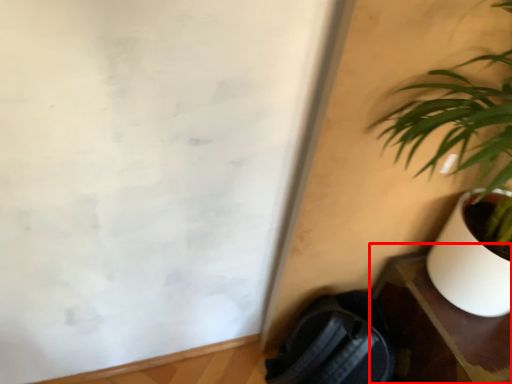
Question: Considering the relative positions of table (annotated by the red box) and houseplant in the image provided, where is table (annotated by the red box) located with respect to the staircase?

Choices:
 (A) right
 (B) left

Answer: (A)